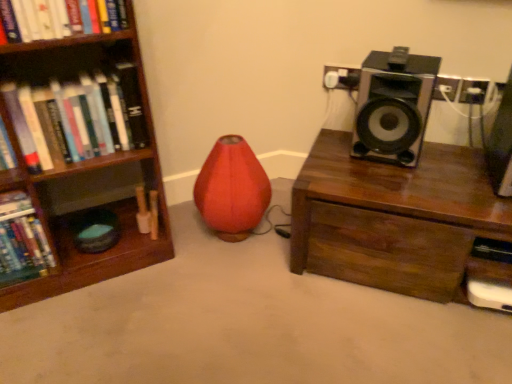
The image size is (512, 384). Identify the location of black plastic speaker at upper right, which ranks as the 1th speaker in left-to-right order. [393, 105].

Image resolution: width=512 pixels, height=384 pixels. Describe the element at coordinates (74, 118) in the screenshot. I see `hardcover book at left, the second book ordered from the bottom` at that location.

What is the approximate height of hardcover book at left, positioned as the 1th book in right-to-left order?

hardcover book at left, positioned as the 1th book in right-to-left order, is 10.13 inches tall.

Where is `brown wooden chest at right`? brown wooden chest at right is located at coordinates (397, 219).

What do you see at coordinates (397, 219) in the screenshot?
I see `brown wooden chest at right` at bounding box center [397, 219].

Where is `matte red bean bag chair at center`? This screenshot has height=384, width=512. matte red bean bag chair at center is located at coordinates (232, 189).

This screenshot has width=512, height=384. Identify the location of black plastic speaker at upper right, the second speaker from the right. (393, 105).

Looking at this image, could you tell me if black plastic speaker at upper right, the second speaker from the right, is turned towards matte red bean bag chair at center?

No, black plastic speaker at upper right, the second speaker from the right, is not oriented towards matte red bean bag chair at center.

Considering the sizes of objects black plastic speaker at upper right, the second speaker from the right, and matte red bean bag chair at center in the image provided, who is thinner, black plastic speaker at upper right, the second speaker from the right, or matte red bean bag chair at center?

black plastic speaker at upper right, the second speaker from the right.

Is the surface of black plastic speaker at upper right, which ranks as the 1th speaker in left-to-right order, in direct contact with matte red bean bag chair at center?

No, black plastic speaker at upper right, which ranks as the 1th speaker in left-to-right order, is not beside matte red bean bag chair at center.

Is point (502, 152) closer or farther from the camera than point (242, 228)?

Point (502, 152) is closer to the camera than point (242, 228).

From the image's perspective, which one is positioned lower, metallic silver speaker at upper right, which is the 1th speaker from right to left, or matte red bean bag chair at center?

matte red bean bag chair at center, from the image's perspective.

Does metallic silver speaker at upper right, which is the 1th speaker from right to left, have a greater height compared to matte red bean bag chair at center?

Incorrect, the height of metallic silver speaker at upper right, which is the 1th speaker from right to left, is not larger of that of matte red bean bag chair at center.

From the picture: Is metallic silver speaker at upper right, which is the 1th speaker from right to left, not within matte red bean bag chair at center?

Yes, metallic silver speaker at upper right, which is the 1th speaker from right to left, is not within matte red bean bag chair at center.

Does hardcover book at left, positioned as the second book in left-to-right order, appear on the left side of matte red bean bag chair at center?

Indeed, hardcover book at left, positioned as the second book in left-to-right order, is positioned on the left side of matte red bean bag chair at center.

Is matte red bean bag chair at center a part of hardcover book at left, positioned as the 1th book in right-to-left order?

Actually, matte red bean bag chair at center is outside hardcover book at left, positioned as the 1th book in right-to-left order.

How many degrees apart are the facing directions of hardcover book at left, positioned as the second book in left-to-right order, and matte red bean bag chair at center?

4.78 degrees.

Is black plastic speaker at upper right, the second speaker from the right, looking in the opposite direction of brown wooden chest at right?

black plastic speaker at upper right, the second speaker from the right, does not have its back to brown wooden chest at right.

From a real-world perspective, is black plastic speaker at upper right, which ranks as the 1th speaker in left-to-right order, positioned over brown wooden chest at right based on gravity?

Indeed, from a real-world perspective, black plastic speaker at upper right, which ranks as the 1th speaker in left-to-right order, stands above brown wooden chest at right.

Between black plastic speaker at upper right, the second speaker from the right, and brown wooden chest at right, which one has less height?

black plastic speaker at upper right, the second speaker from the right.

From a real-world perspective, starting from the brown wooden chest at right, which speaker is the 2nd one vertically above it? Please provide its 2D coordinates.

[(393, 105)]

Locate an element on the screen. book in front of the hardcover book at left, which is the second book from right to left is located at coordinates (74, 118).

From the picture: In terms of width, does hardcover book at left, placed as the 2th book when sorted from top to bottom, look wider or thinner when compared to hardcover book at left, positioned as the 1th book in right-to-left order?

Clearly, hardcover book at left, placed as the 2th book when sorted from top to bottom, has more width compared to hardcover book at left, positioned as the 1th book in right-to-left order.

Choose the correct answer: Is hardcover book at left, placed as the 2th book when sorted from top to bottom, inside hardcover book at left, positioned as the second book in left-to-right order, or outside it?

hardcover book at left, placed as the 2th book when sorted from top to bottom, exists outside the volume of hardcover book at left, positioned as the second book in left-to-right order.

Based on the photo, based on their positions, is hardcover book at left, which is the second book from right to left, located to the left or right of hardcover book at left, positioned as the 1th book in right-to-left order?

From the image, it's evident that hardcover book at left, which is the second book from right to left, is to the left of hardcover book at left, positioned as the 1th book in right-to-left order.

I want to click on book located above the metallic silver speaker at upper right, which ranks as the 2th speaker in left-to-right order (from the image's perspective), so click(74, 118).

Which is more to the right, metallic silver speaker at upper right, which is the 1th speaker from right to left, or hardcover book at left, positioned as the second book in left-to-right order?

metallic silver speaker at upper right, which is the 1th speaker from right to left.

From a real-world perspective, which object stands above the other?

hardcover book at left, positioned as the 1th book in right-to-left order.

Considering their positions, is metallic silver speaker at upper right, which ranks as the 2th speaker in left-to-right order, located in front of or behind hardcover book at left, the second book ordered from the bottom?

In the image, metallic silver speaker at upper right, which ranks as the 2th speaker in left-to-right order, appears in front of hardcover book at left, the second book ordered from the bottom.

Consider the image. Which is closer, (231,157) or (397,94)?

Point (231,157).

Is matte red bean bag chair at center to the right of black plastic speaker at upper right, the second speaker from the right, from the viewer's perspective?

No.

Which of these two, matte red bean bag chair at center or black plastic speaker at upper right, which ranks as the 1th speaker in left-to-right order, is bigger?

Bigger between the two is matte red bean bag chair at center.

There is a matte red bean bag chair at center. Where is `the 2nd speaker above it (from a real-world perspective)`? This screenshot has height=384, width=512. the 2nd speaker above it (from a real-world perspective) is located at coordinates tap(393, 105).

Identify the location of the 1st speaker positioned above the matte red bean bag chair at center (from the image's perspective). This screenshot has width=512, height=384. (501, 145).

From the image, which object appears to be nearer to hardcover book at left, acting as the first book starting from the top, metallic silver speaker at upper right, which ranks as the 2th speaker in left-to-right order, or matte red bean bag chair at center?

Based on the image, matte red bean bag chair at center appears to be nearer to hardcover book at left, acting as the first book starting from the top.

From the image, which object appears to be nearer to hardcover book at left, which is the second book from right to left, black plastic speaker at upper right, the second speaker from the right, or metallic silver speaker at upper right, which ranks as the 2th speaker in left-to-right order?

black plastic speaker at upper right, the second speaker from the right, is positioned closer to the anchor hardcover book at left, which is the second book from right to left.

When comparing their distances from metallic silver speaker at upper right, which is the 1th speaker from right to left, does brown wooden chest at right or hardcover book at left, the first book in the left-to-right sequence, seem further?

Based on the image, hardcover book at left, the first book in the left-to-right sequence, appears to be further to metallic silver speaker at upper right, which is the 1th speaker from right to left.

Estimate the real-world distances between objects in this image. Which object is closer to black plastic speaker at upper right, the second speaker from the right, hardcover book at left, positioned as the second book in left-to-right order, or brown wooden chest at right?

The object closer to black plastic speaker at upper right, the second speaker from the right, is brown wooden chest at right.

Looking at the image, which one is located further to hardcover book at left, the second book ordered from the bottom, hardcover book at left, placed as the 2th book when sorted from top to bottom, or brown wooden chest at right?

The object further to hardcover book at left, the second book ordered from the bottom, is brown wooden chest at right.

Estimate the real-world distances between objects in this image. Which object is closer to hardcover book at left, positioned as the second book in left-to-right order, metallic silver speaker at upper right, which is the 1th speaker from right to left, or black plastic speaker at upper right, the second speaker from the right?

black plastic speaker at upper right, the second speaker from the right, lies closer to hardcover book at left, positioned as the second book in left-to-right order, than the other object.

Looking at the image, which one is located closer to brown wooden chest at right, black plastic speaker at upper right, the second speaker from the right, or metallic silver speaker at upper right, which is the 1th speaker from right to left?

black plastic speaker at upper right, the second speaker from the right, is closer to brown wooden chest at right.

From the image, which object appears to be farther from metallic silver speaker at upper right, which ranks as the 2th speaker in left-to-right order, hardcover book at left, the first book in the left-to-right sequence, or hardcover book at left, the second book ordered from the bottom?

hardcover book at left, the first book in the left-to-right sequence.

Locate an element on the screen. The width and height of the screenshot is (512, 384). bean bag chair located between hardcover book at left, the second book ordered from the bottom, and metallic silver speaker at upper right, which is the 1th speaker from right to left, in the left-right direction is located at coordinates (232, 189).

Find the location of a particular element. Image resolution: width=512 pixels, height=384 pixels. book located between hardcover book at left, placed as the 2th book when sorted from top to bottom, and black plastic speaker at upper right, which ranks as the 1th speaker in left-to-right order, in the left-right direction is located at coordinates (74, 118).

Find the location of `speaker between black plastic speaker at upper right, the second speaker from the right, and brown wooden chest at right, in the vertical direction`. speaker between black plastic speaker at upper right, the second speaker from the right, and brown wooden chest at right, in the vertical direction is located at coordinates (501, 145).

Image resolution: width=512 pixels, height=384 pixels. Find the location of `desk between matte red bean bag chair at center and metallic silver speaker at upper right, which is the 1th speaker from right to left`. desk between matte red bean bag chair at center and metallic silver speaker at upper right, which is the 1th speaker from right to left is located at coordinates (397, 219).